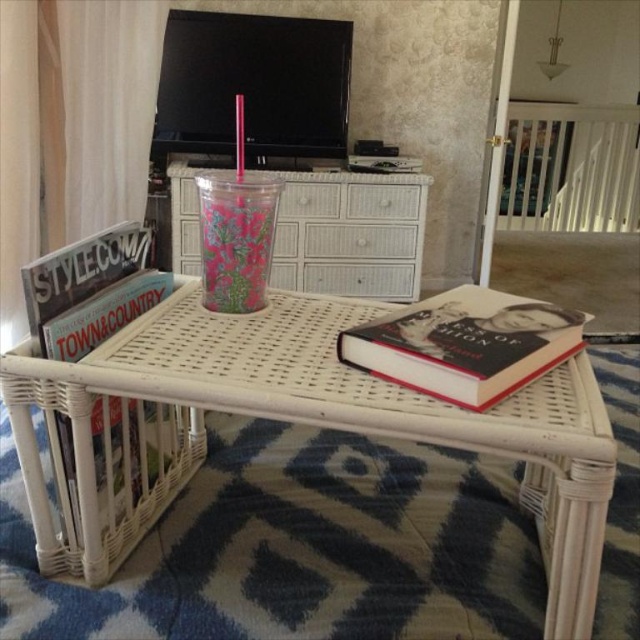
You are holding a remote control that is 15 centimeters long. You want to place it on the white wicker table at center. Can you fit it on the table without it hanging over the edge?

The white wicker table at center is 71.47 centimeters from the camera. The distance from the camera does not indicate the table size, so we cannot determine if the remote control will fit without additional information about the table dimensions.

You are arranging items on the white wicker table at center and the hardcover book at center. According to the scene, which item is located to the right of the other?

The hardcover book at center is located to the right of the white wicker table at center because the white wicker table at center is positioned on the left side of the hardcover book at center.

You are organizing a small party and need to place a centerpiece on the white wicker table at center. However, you notice the matte black magazine at left might block the view. Based on their positions, will the magazine obstruct the view of the table from the front?

The white wicker table at center is below the matte black magazine at left, so the magazine is positioned above the table. This means the matte black magazine at left could potentially block the view of the table from the front depending on their vertical alignment.